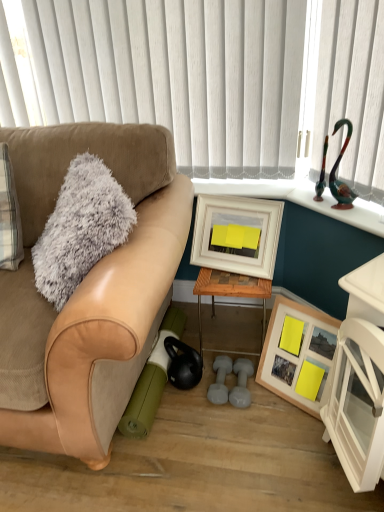
Locate an element on the screen. The width and height of the screenshot is (384, 512). free spot to the left of wooden framed picture at lower right, which appears as the second picture frame when viewed from the top is located at coordinates (258, 413).